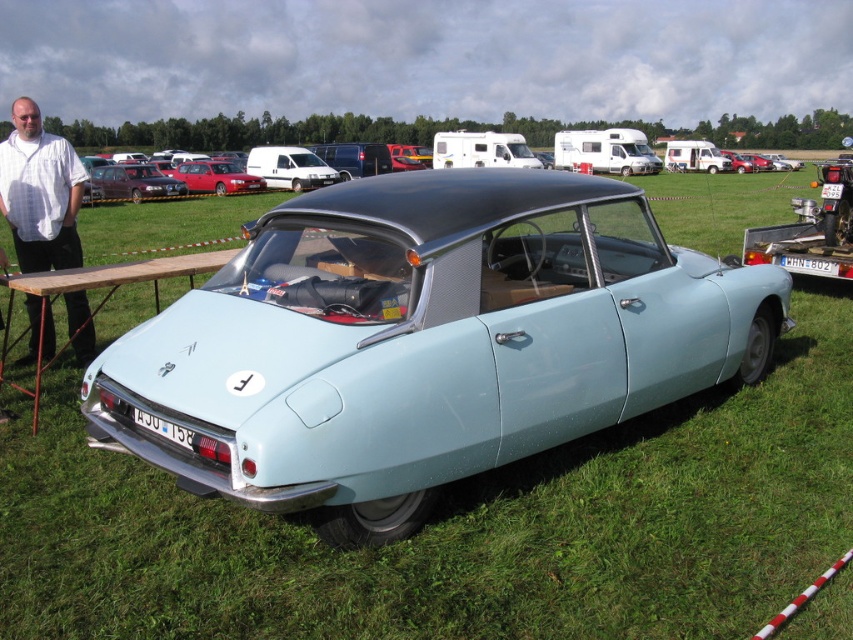
Question: Which of the following is the closest to the observer?

Choices:
 (A) (173, 189)
 (B) (49, 294)

Answer: (B)

Question: Can you confirm if light blue matte car at center is bigger than shiny red car at center?

Choices:
 (A) no
 (B) yes

Answer: (B)

Question: In this image, where is metallic red car at center located relative to shiny red car at center?

Choices:
 (A) left
 (B) right

Answer: (A)

Question: In this image, where is white shirt at left located relative to shiny red car at center?

Choices:
 (A) right
 (B) left

Answer: (A)

Question: Which point is closer to the camera?

Choices:
 (A) (517, 435)
 (B) (107, 166)
 (C) (38, 289)

Answer: (A)

Question: Which object is closer to the camera taking this photo?

Choices:
 (A) metallic red car at center
 (B) wooden picnic table at center
 (C) light blue matte car at center

Answer: (C)